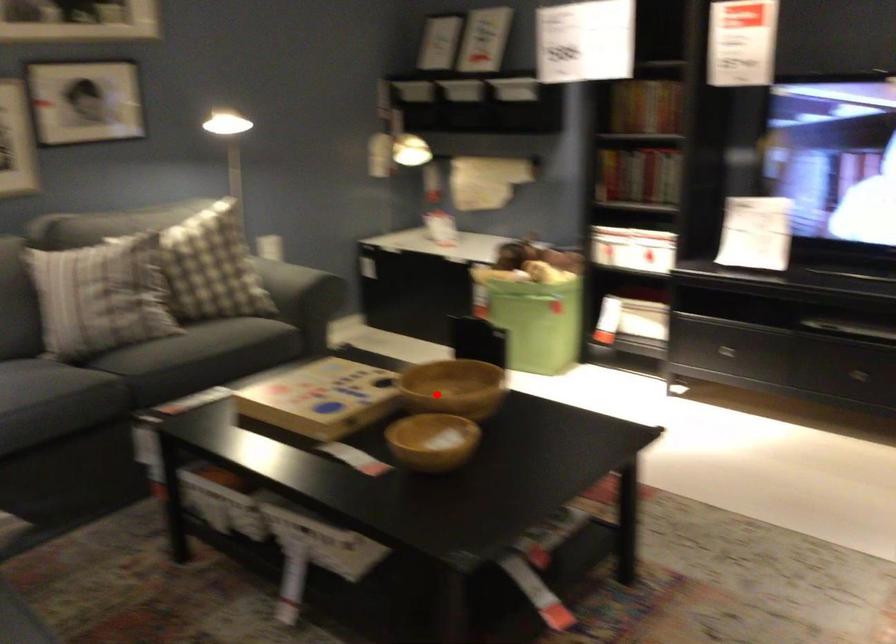
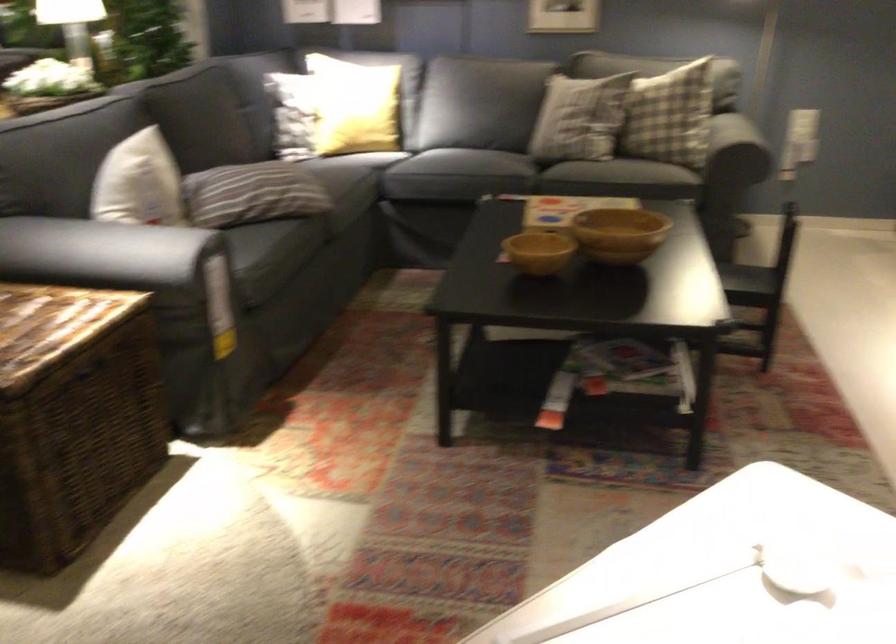
Question: I am providing you with two images of the same scene from different viewpoints. A red point is shown in image1. For the corresponding object point in image2, is it positioned nearer or farther from the camera?

Choices:
 (A) Nearer
 (B) Farther

Answer: (B)